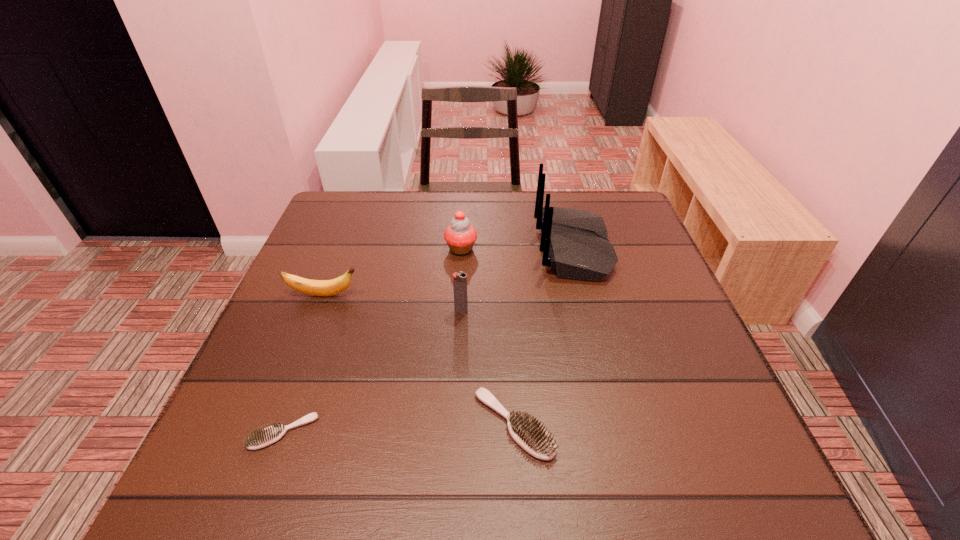
I want to click on the left scrubbing brush, so click(x=260, y=438).

The height and width of the screenshot is (540, 960). I want to click on the shortest object, so click(260, 438).

At what (x,y) coordinates should I click in order to perform the action: click on the taller scrubbing brush. Please return your answer as a coordinate pair (x, y). This screenshot has width=960, height=540. Looking at the image, I should click on (525, 429).

What are the coordinates of `the right scrubbing brush` in the screenshot? It's located at (525, 429).

The width and height of the screenshot is (960, 540). What are the coordinates of `cupcake` in the screenshot? It's located at (460, 236).

The image size is (960, 540). In order to click on the tallest object in this screenshot , I will do `click(574, 242)`.

You are a GUI agent. You are given a task and a screenshot of the screen. Output one action in this format:
    pyautogui.click(x=<x>, y=<y>)
    Task: Click on the router
    This screenshot has width=960, height=540.
    Given the screenshot: What is the action you would take?
    click(574, 242)

What are the coordinates of `banana` in the screenshot? It's located at (335, 286).

Find the location of a particular element. The image size is (960, 540). the fourth nearest object is located at coordinates (335, 286).

Locate an element on the screen. The image size is (960, 540). igniter is located at coordinates (459, 279).